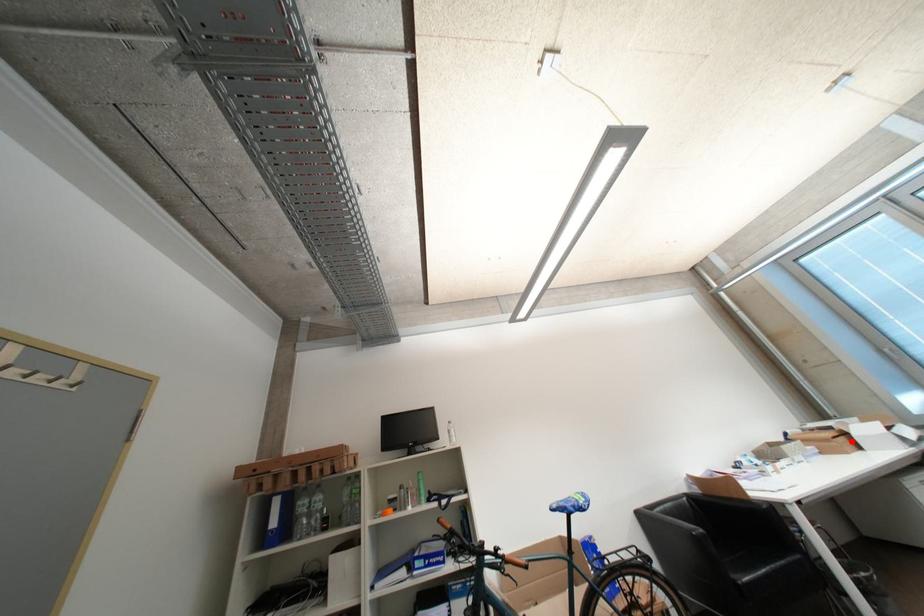
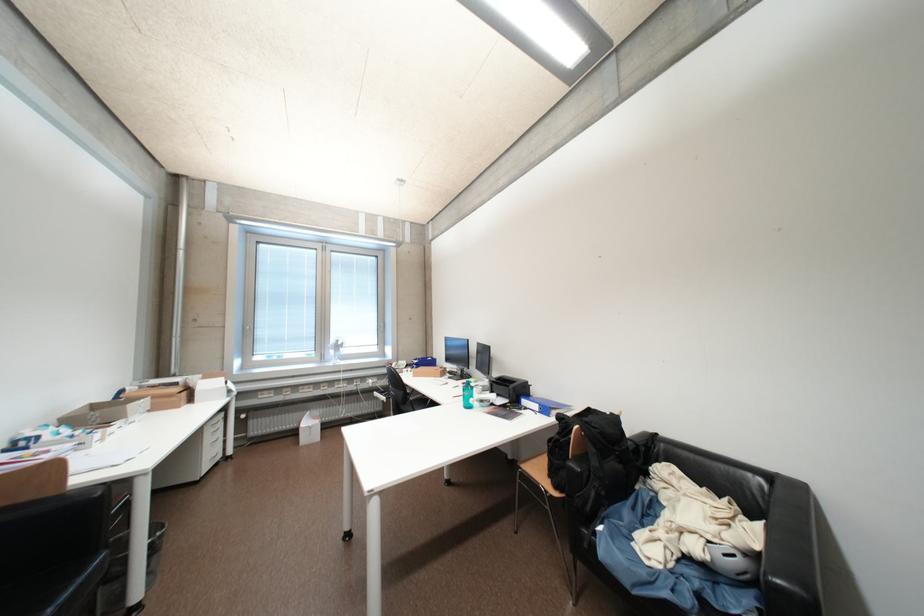
The point at the highlighted location is marked in the first image. Where is the corresponding point in the second image?

(192, 395)